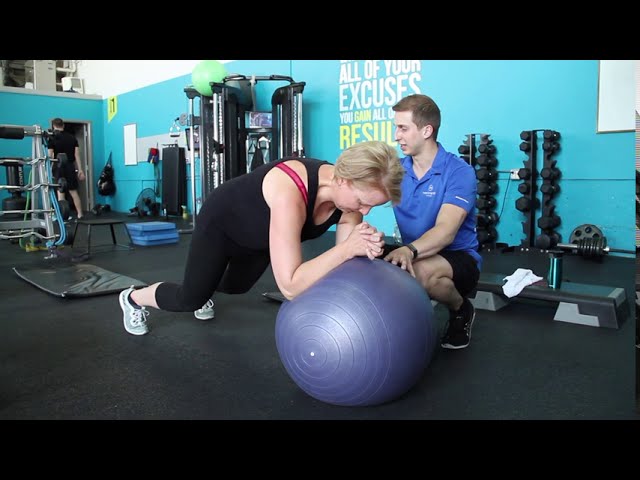
Image resolution: width=640 pixels, height=480 pixels. I want to click on exercise ball, so click(384, 317).